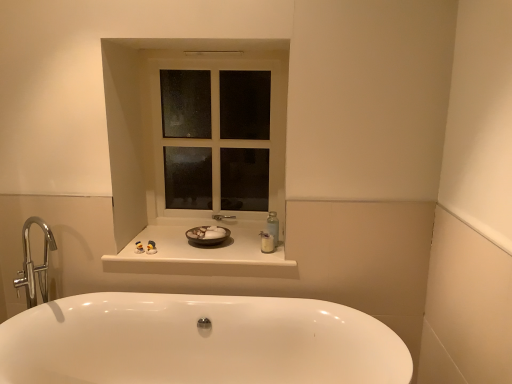
What do you see at coordinates (219, 126) in the screenshot? I see `white glass window at center` at bounding box center [219, 126].

You are a GUI agent. You are given a task and a screenshot of the screen. Output one action in this format:
    pyautogui.click(x=<x>, y=<y>)
    Task: Click on the translucent plastic bottle at center, the 1th toiletry in the right-to-left sequence
    
    Given the screenshot: What is the action you would take?
    pyautogui.click(x=267, y=242)

What do you see at coordinates (198, 341) in the screenshot?
I see `white glossy bathtub at lower center` at bounding box center [198, 341].

Describe the element at coordinates (202, 255) in the screenshot. The image size is (512, 384). I see `white glossy counter top at center` at that location.

Image resolution: width=512 pixels, height=384 pixels. I want to click on white glass window at center, so click(x=219, y=126).

Locate an element on the screen. This screenshot has width=512, height=384. counter top to the left of translucent plastic bottle at center, the 1th toiletry in the right-to-left sequence is located at coordinates (202, 255).

Considering their positions, is white glossy counter top at center located in front of or behind translucent plastic bottle at center, the 1th toiletry in the right-to-left sequence?

white glossy counter top at center is positioned closer to the viewer than translucent plastic bottle at center, the 1th toiletry in the right-to-left sequence.

Which is correct: white glossy counter top at center is inside translucent plastic bottle at center, the second toiletry positioned from the left, or outside of it?

white glossy counter top at center is not enclosed by translucent plastic bottle at center, the second toiletry positioned from the left.

Is white glossy counter top at center taller or shorter than translucent plastic bottle at center, the second toiletry positioned from the left?

Considering their sizes, white glossy counter top at center has less height than translucent plastic bottle at center, the second toiletry positioned from the left.

From the image's perspective, between translucent plastic bottle at center, the 1th toiletry in the right-to-left sequence, and white glossy toiletries at center, the 1th toiletry in the left-to-right sequence, who is located below?

From the image's view, white glossy toiletries at center, the 1th toiletry in the left-to-right sequence, is below.

Is translucent plastic bottle at center, the 1th toiletry in the right-to-left sequence, beside white glossy toiletries at center, arranged as the 2th toiletry when viewed from the right?

No, translucent plastic bottle at center, the 1th toiletry in the right-to-left sequence, is not making contact with white glossy toiletries at center, arranged as the 2th toiletry when viewed from the right.

Looking at this image, is translucent plastic bottle at center, the second toiletry positioned from the left, smaller than white glossy toiletries at center, arranged as the 2th toiletry when viewed from the right?

No.

Which object is positioned more to the right, white glossy toiletries at center, arranged as the 2th toiletry when viewed from the right, or brown matte bowl at center?

brown matte bowl at center is more to the right.

Considering the relative sizes of white glossy toiletries at center, arranged as the 2th toiletry when viewed from the right, and brown matte bowl at center in the image provided, is white glossy toiletries at center, arranged as the 2th toiletry when viewed from the right, shorter than brown matte bowl at center?

Yes, white glossy toiletries at center, arranged as the 2th toiletry when viewed from the right, is shorter than brown matte bowl at center.

Which of these two, white glossy toiletries at center, the 1th toiletry in the left-to-right sequence, or brown matte bowl at center, is smaller?

white glossy toiletries at center, the 1th toiletry in the left-to-right sequence.

From the image's perspective, who appears lower, white glossy toiletries at center, arranged as the 2th toiletry when viewed from the right, or brown matte bowl at center?

From the image's view, white glossy toiletries at center, arranged as the 2th toiletry when viewed from the right, is below.

Measure the distance between translucent plastic bottle at center, the second toiletry positioned from the left, and white glass window at center.

They are 71.96 centimeters apart.

In the image, is translucent plastic bottle at center, the second toiletry positioned from the left, on the left side or the right side of white glass window at center?

In the image, translucent plastic bottle at center, the second toiletry positioned from the left, appears on the right side of white glass window at center.

From the image's perspective, is translucent plastic bottle at center, the second toiletry positioned from the left, positioned above or below white glass window at center?

Based on their image positions, translucent plastic bottle at center, the second toiletry positioned from the left, is located beneath white glass window at center.

Is translucent plastic bottle at center, the second toiletry positioned from the left, oriented away from white glass window at center?

Correct, translucent plastic bottle at center, the second toiletry positioned from the left, is looking away from white glass window at center.

Which is farther from the camera, [149,371] or [227,239]?

The point [227,239] is farther.

Based on the photo, is there a large distance between white glossy bathtub at lower center and brown matte bowl at center?

Actually, white glossy bathtub at lower center and brown matte bowl at center are a little close together.

Considering the relative positions of white glossy bathtub at lower center and brown matte bowl at center in the image provided, is white glossy bathtub at lower center in front of brown matte bowl at center?

Yes, white glossy bathtub at lower center is closer to the viewer.

Consider the image. Measure the distance from translucent plastic bottle at center, the second toiletry positioned from the left, to white glossy counter top at center.

The distance of translucent plastic bottle at center, the second toiletry positioned from the left, from white glossy counter top at center is 12.77 inches.

Between translucent plastic bottle at center, the second toiletry positioned from the left, and white glossy counter top at center, which one has larger width?

With larger width is white glossy counter top at center.

Does translucent plastic bottle at center, the second toiletry positioned from the left, have a lesser height compared to white glossy counter top at center?

No, translucent plastic bottle at center, the second toiletry positioned from the left, is not shorter than white glossy counter top at center.

At what (x,y) coordinates should I click in order to perform the action: click on toiletry that is the 1st object located behind the white glossy counter top at center. Please return your answer as a coordinate pair (x, y). Looking at the image, I should click on (267, 242).

Is white glossy toiletries at center, arranged as the 2th toiletry when viewed from the right, spatially inside white glass window at center, or outside of it?

white glossy toiletries at center, arranged as the 2th toiletry when viewed from the right, is not inside white glass window at center, it's outside.

In terms of height, does white glossy toiletries at center, the 1th toiletry in the left-to-right sequence, look taller or shorter compared to white glass window at center?

Clearly, white glossy toiletries at center, the 1th toiletry in the left-to-right sequence, is shorter compared to white glass window at center.

Locate an element on the screen. This screenshot has width=512, height=384. counter top on the left of translucent plastic bottle at center, the second toiletry positioned from the left is located at coordinates (202, 255).

Locate an element on the screen. The height and width of the screenshot is (384, 512). toiletry lying behind the translucent plastic bottle at center, the 1th toiletry in the right-to-left sequence is located at coordinates (139, 247).

Which object lies further to the anchor point white glossy toiletries at center, the 1th toiletry in the left-to-right sequence, white glass window at center or brown matte bowl at center?

Among the two, white glass window at center is located further to white glossy toiletries at center, the 1th toiletry in the left-to-right sequence.

Considering their positions, is white glossy toiletries at center, the 1th toiletry in the left-to-right sequence, positioned closer to brown matte bowl at center than white glossy bathtub at lower center?

white glossy toiletries at center, the 1th toiletry in the left-to-right sequence, lies closer to brown matte bowl at center than the other object.

Based on their spatial positions, is translucent plastic bottle at center, the second toiletry positioned from the left, or white glossy counter top at center further from brown matte bowl at center?

The object further to brown matte bowl at center is translucent plastic bottle at center, the second toiletry positioned from the left.

Based on their spatial positions, is white glossy counter top at center or white glossy toiletries at center, arranged as the 2th toiletry when viewed from the right, closer to brown matte bowl at center?

Among the two, white glossy counter top at center is located nearer to brown matte bowl at center.

Considering their positions, is white glass window at center positioned closer to translucent plastic bottle at center, the second toiletry positioned from the left, than brown matte bowl at center?

brown matte bowl at center is closer to translucent plastic bottle at center, the second toiletry positioned from the left.

When comparing their distances from white glossy toiletries at center, arranged as the 2th toiletry when viewed from the right, does brown matte bowl at center or white glossy counter top at center seem further?

The object further to white glossy toiletries at center, arranged as the 2th toiletry when viewed from the right, is white glossy counter top at center.

Considering their positions, is white glossy toiletries at center, arranged as the 2th toiletry when viewed from the right, positioned further to brown matte bowl at center than translucent plastic bottle at center, the second toiletry positioned from the left?

Among the two, white glossy toiletries at center, arranged as the 2th toiletry when viewed from the right, is located further to brown matte bowl at center.

When comparing their distances from white glossy bathtub at lower center, does white glass window at center or white glossy counter top at center seem closer?

white glossy counter top at center lies closer to white glossy bathtub at lower center than the other object.

Locate an element on the screen. counter top located between white glossy bathtub at lower center and translucent plastic bottle at center, the second toiletry positioned from the left, in the depth direction is located at coordinates (202, 255).

At what (x,y) coordinates should I click in order to perform the action: click on sink between white glossy toiletries at center, arranged as the 2th toiletry when viewed from the right, and translucent plastic bottle at center, the 1th toiletry in the right-to-left sequence, in the horizontal direction. Please return your answer as a coordinate pair (x, y). The image size is (512, 384). Looking at the image, I should click on (207, 235).

The image size is (512, 384). What are the coordinates of `sink located between white glossy counter top at center and translucent plastic bottle at center, the 1th toiletry in the right-to-left sequence, in the left-right direction` in the screenshot? It's located at (207, 235).

You are a GUI agent. You are given a task and a screenshot of the screen. Output one action in this format:
    pyautogui.click(x=<x>, y=<y>)
    Task: Click on the counter top situated between white glossy toiletries at center, arranged as the 2th toiletry when viewed from the right, and brown matte bowl at center from left to right
    Image resolution: width=512 pixels, height=384 pixels.
    Given the screenshot: What is the action you would take?
    [x=202, y=255]